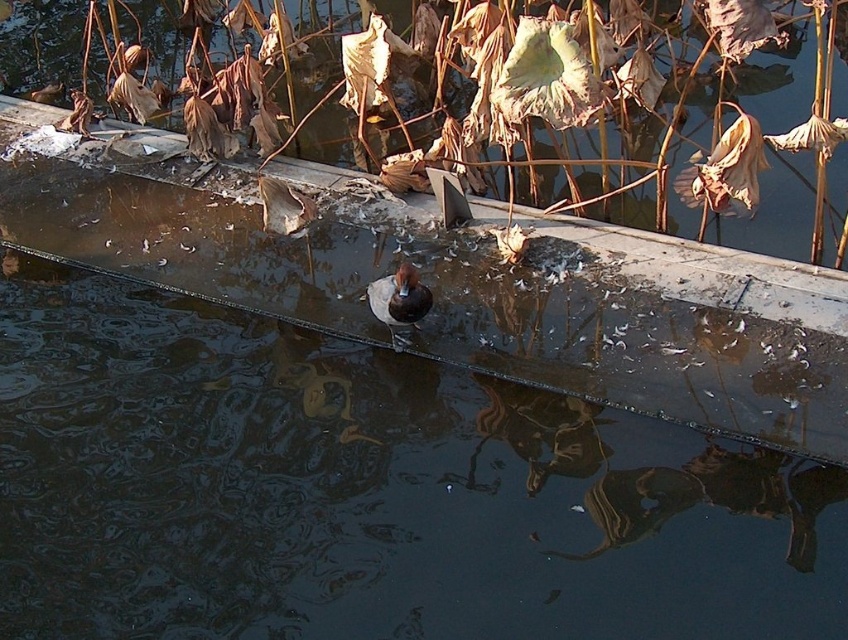
Question: Can you confirm if brown dried leaves at upper center is smaller than brown matte duck at center?

Choices:
 (A) yes
 (B) no

Answer: (B)

Question: Does brown dried leaves at upper center have a lesser width compared to brown matte duck at center?

Choices:
 (A) no
 (B) yes

Answer: (A)

Question: Which of the following is the closest to the observer?

Choices:
 (A) (763, 65)
 (B) (395, 346)

Answer: (B)

Question: Does brown dried leaves at upper center come in front of brown matte duck at center?

Choices:
 (A) no
 (B) yes

Answer: (B)